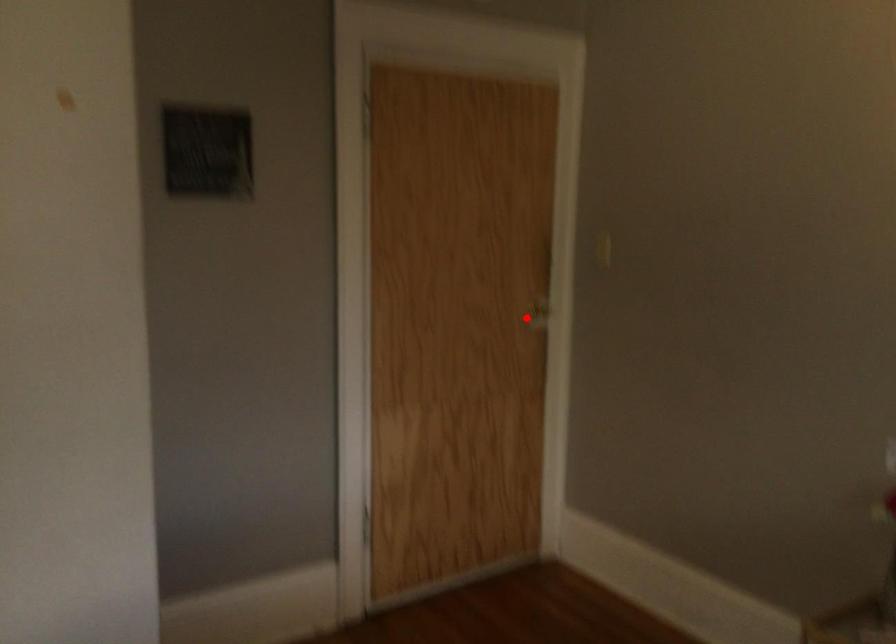
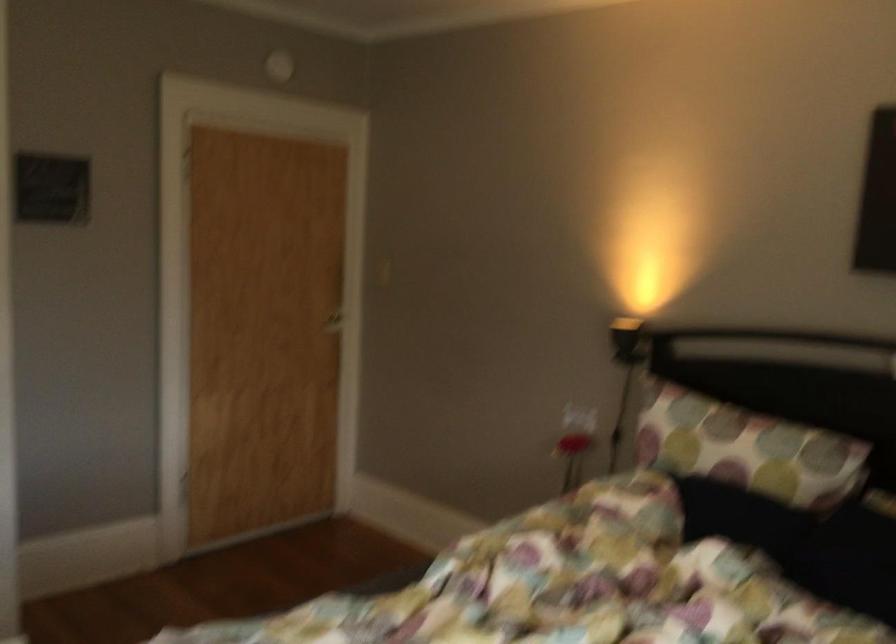
Question: I am providing you with two images of the same scene from different viewpoints. A red point is shown in image1. For the corresponding object point in image2, is it positioned nearer or farther from the camera?

Choices:
 (A) Nearer
 (B) Farther

Answer: (B)